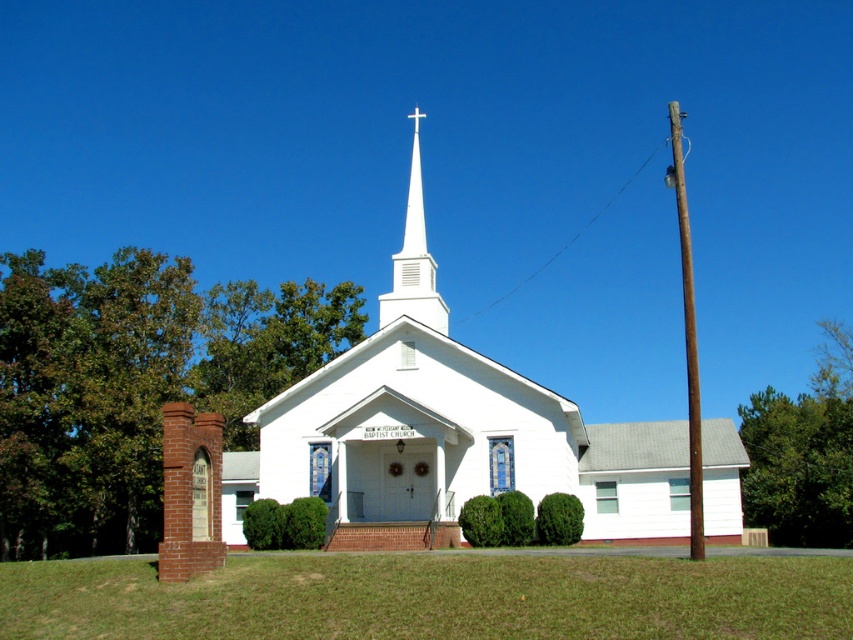
You are planning to install a new pathway between the white matte church at center and the brown wooden pole at right. The pathway requires a minimum of 50 feet of space to be constructed. Based on the given information, can the pathway be built between these two objects?

The distance between the white matte church at center and the brown wooden pole at right is 47.49 feet, which is less than the required 50 feet. Therefore, the pathway cannot be built between these two objects.

You are standing in front of the church and want to take a photo that includes both the white matte church at center and the brown wooden pole at right. Based on their positions, which object should appear higher in the photo?

The white matte church at center is positioned above the brown wooden pole at right, so it will appear higher in the photo.

You are planning to install a new sign above the white matte church at center and the white smooth steeple at center. Based on their widths, which object requires a larger sign to fit its width?

The white matte church at center might be wider than white smooth steeple at center, so the sign for the white matte church at center should be larger to accommodate its width.